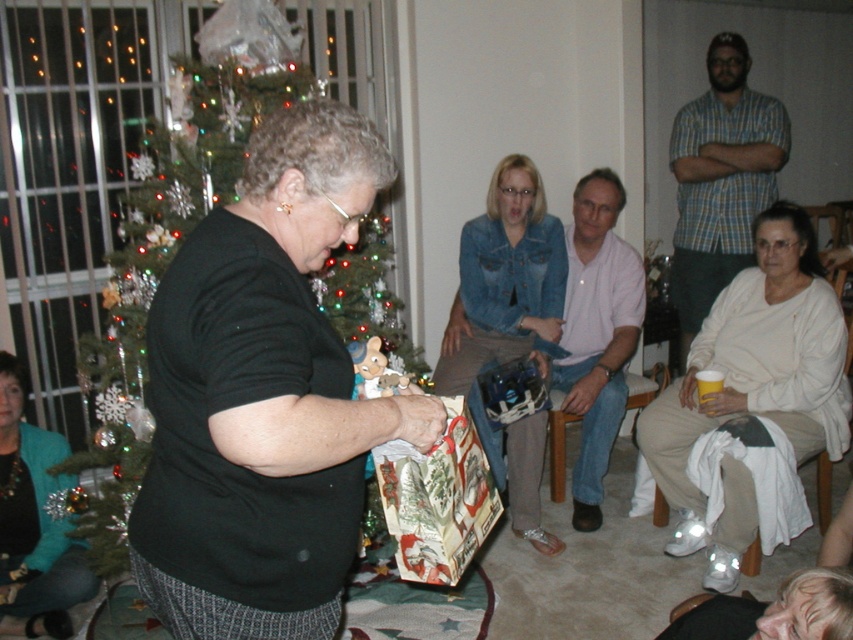
Is green shiny christmas tree at left thinner than pink cotton shirt at center?

In fact, green shiny christmas tree at left might be wider than pink cotton shirt at center.

This screenshot has width=853, height=640. In order to click on green shiny christmas tree at left in this screenshot , I will do `click(173, 237)`.

Where is `green shiny christmas tree at left`? The image size is (853, 640). green shiny christmas tree at left is located at coordinates (173, 237).

Is point (456, 316) behind point (3, 381)?

That is True.

This screenshot has width=853, height=640. What do you see at coordinates (508, 324) in the screenshot?
I see `denim jacket at center` at bounding box center [508, 324].

You are a GUI agent. You are given a task and a screenshot of the screen. Output one action in this format:
    pyautogui.click(x=<x>, y=<y>)
    Task: Click on the denim jacket at center
    The image size is (853, 640).
    Given the screenshot: What is the action you would take?
    pyautogui.click(x=508, y=324)

Who is more distant from viewer, (x=692, y=205) or (x=393, y=467)?

The point (x=692, y=205) is more distant.

Where is `blue plaid shirt at upper right`? blue plaid shirt at upper right is located at coordinates (720, 179).

Between point (677, 275) and point (456, 403), which one is positioned behind?

Positioned behind is point (677, 275).

Identify the location of blue plaid shirt at upper right. (720, 179).